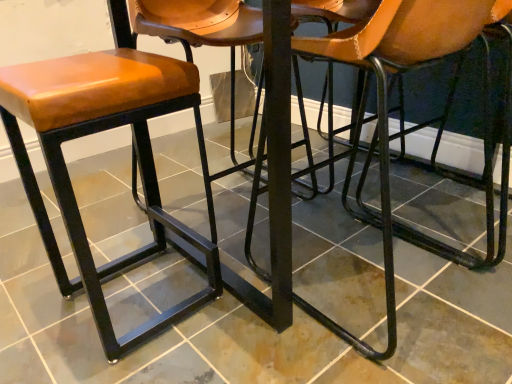
What are the coordinates of `free area in between matte brown leather stool at left and brown leather chair at center` in the screenshot? It's located at (248, 317).